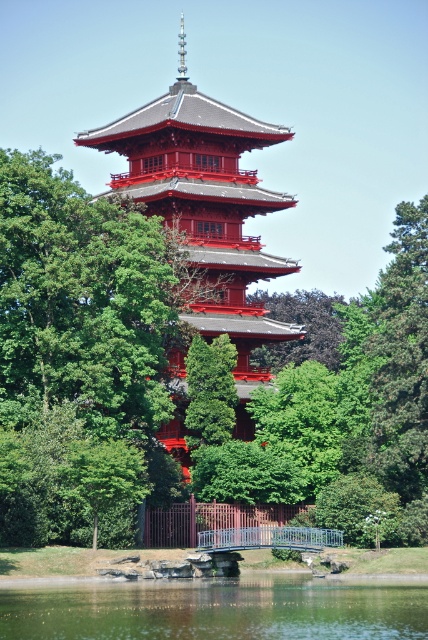
Question: Is shiny red pagoda at center closer to the viewer compared to green leafy tree at center?

Choices:
 (A) no
 (B) yes

Answer: (B)

Question: Can you confirm if green leafy tree at center is positioned to the right of green textured tree at center?

Choices:
 (A) yes
 (B) no

Answer: (A)

Question: Which point is farther from the camera taking this photo?

Choices:
 (A) (406, 582)
 (B) (219, 387)
 (C) (143, 188)

Answer: (C)

Question: Considering the relative positions of green reflective water at lower center and green textured tree at center in the image provided, where is green reflective water at lower center located with respect to green textured tree at center?

Choices:
 (A) above
 (B) below

Answer: (B)

Question: Which object is closer to the camera taking this photo?

Choices:
 (A) green reflective water at lower center
 (B) green leafy tree at center

Answer: (A)

Question: Which point is closer to the camera?

Choices:
 (A) (169, 586)
 (B) (180, 49)
 (C) (216, 381)
 (D) (338, 337)

Answer: (A)